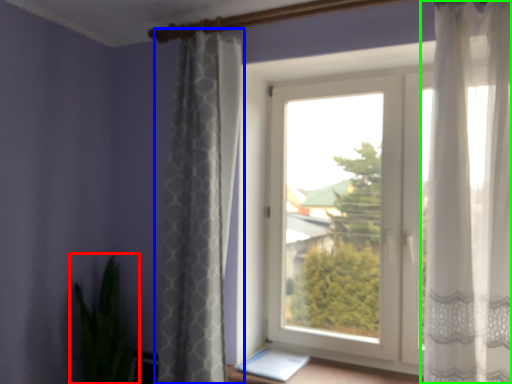
Question: Which object is the closest to the houseplant (highlighted by a red box)? Choose among these: curtain (highlighted by a blue box) or curtain (highlighted by a green box).

Choices:
 (A) curtain
 (B) curtain

Answer: (A)